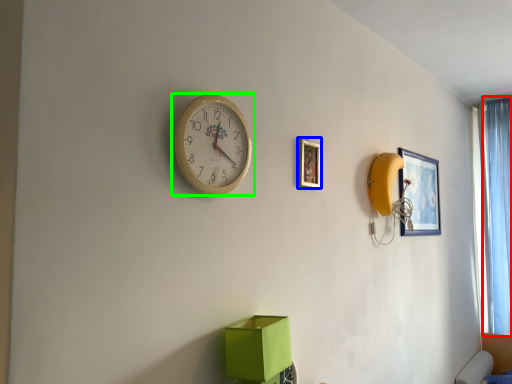
Question: Estimate the real-world distances between objects in this image. Which object is farther from curtain (highlighted by a red box), picture frame (highlighted by a blue box) or wall clock (highlighted by a green box)?

Choices:
 (A) picture frame
 (B) wall clock

Answer: (B)